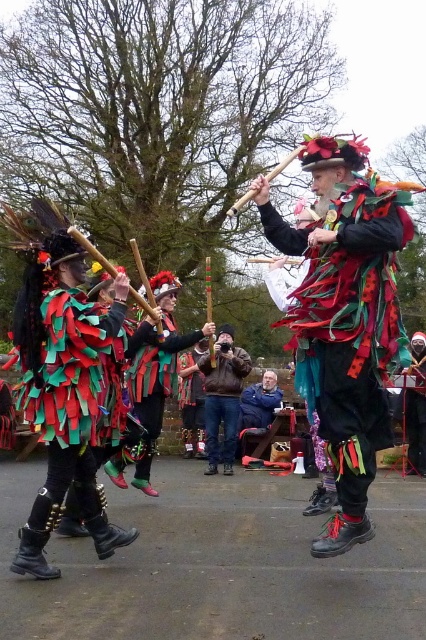
Does multicolored fabric costume at center lie in front of shiny metallic costume at center?

No, it is not.

Is multicolored fabric costume at center to the right of shiny metallic costume at center from the viewer's perspective?

No, multicolored fabric costume at center is not to the right of shiny metallic costume at center.

Between point (14, 321) and point (367, 344), which one is positioned behind?

Positioned behind is point (14, 321).

This screenshot has width=426, height=640. Identify the location of multicolored fabric costume at center. (348, 284).

Can you confirm if green fabric mask at center is thinner than brown leather jacket at center?

Incorrect, green fabric mask at center's width is not less than brown leather jacket at center's.

Is point (176, 349) closer to viewer compared to point (213, 380)?

Yes, point (176, 349) is in front of point (213, 380).

Locate an element on the screen. green fabric mask at center is located at coordinates [x=155, y=381].

Can you confirm if multicolored fabric costume at center is taller than green fabric mask at center?

Yes.

Can you confirm if multicolored fabric costume at center is thinner than green fabric mask at center?

No.

Which is in front, point (14, 339) or point (141, 381)?

Point (14, 339) is in front.

At what (x,y) coordinates should I click in order to perform the action: click on multicolored fabric costume at center. Please return your answer as a coordinate pair (x, y). Looking at the image, I should click on (348, 284).